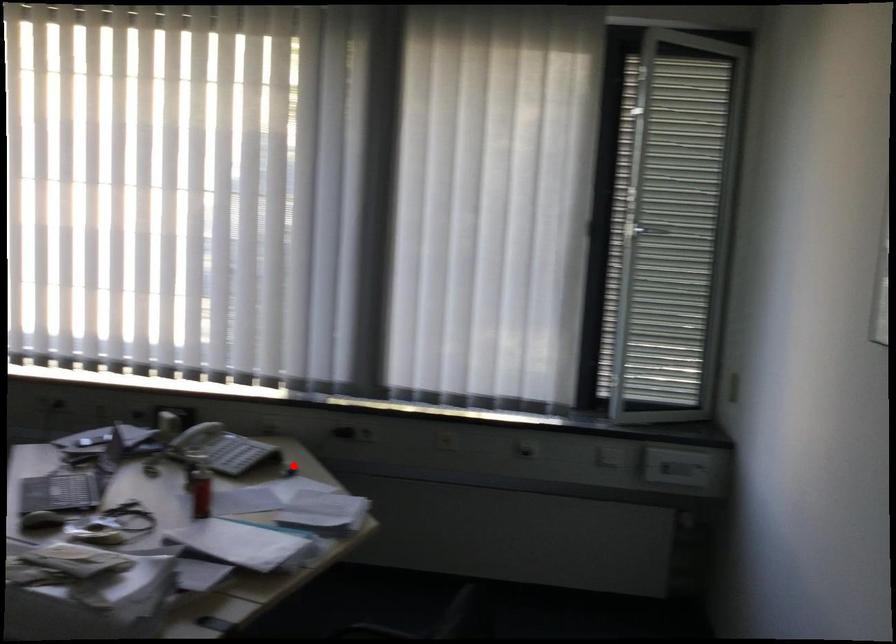
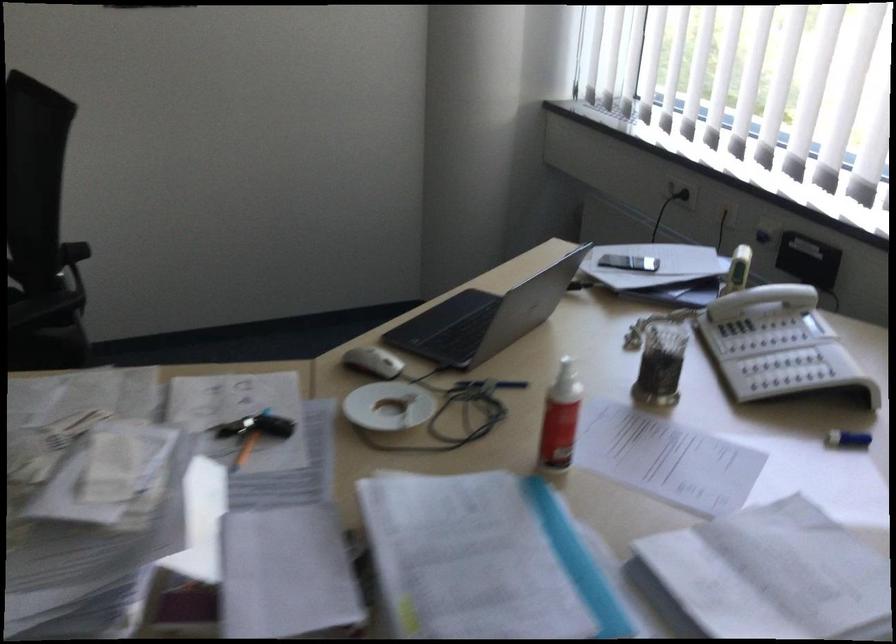
The point at the highlighted location is marked in the first image. Where is the corresponding point in the second image?

(848, 439)